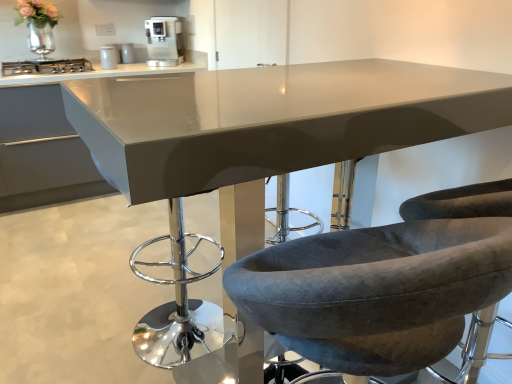
Question: From the image's perspective, is metallic silver coffee machine at upper center, the second appliance viewed from the top, on top of velvet grey chair at center, which is the 1th chair from right to left?

Choices:
 (A) no
 (B) yes

Answer: (B)

Question: Is metallic silver coffee machine at upper center, the second appliance viewed from the top, closer to the viewer compared to velvet grey chair at center, acting as the second chair starting from the left?

Choices:
 (A) yes
 (B) no

Answer: (B)

Question: Is metallic silver coffee machine at upper center, the second appliance positioned from the back, with velvet grey chair at center, which is the 1th chair from right to left?

Choices:
 (A) no
 (B) yes

Answer: (A)

Question: Is metallic silver coffee machine at upper center, which ranks as the 1th appliance in front-to-back order, smaller than velvet grey chair at center, which is the 1th chair from right to left?

Choices:
 (A) no
 (B) yes

Answer: (B)

Question: Is metallic silver coffee machine at upper center, the second appliance viewed from the top, aimed at velvet grey chair at center, which is the 1th chair from right to left?

Choices:
 (A) yes
 (B) no

Answer: (A)

Question: Does metallic silver coffee machine at upper center, marked as the first appliance in a bottom-to-top arrangement, lie behind velvet grey chair at center, acting as the second chair starting from the left?

Choices:
 (A) no
 (B) yes

Answer: (B)

Question: Is velvet grey chair at center, which is the 1th chair from right to left, not inside velvet grey chair at center, arranged as the 1th chair when viewed from the left?

Choices:
 (A) yes
 (B) no

Answer: (A)

Question: Is velvet grey chair at center, the second chair positioned from the right, inside velvet grey chair at center, which is the 1th chair from right to left?

Choices:
 (A) yes
 (B) no

Answer: (B)

Question: Is velvet grey chair at center, which is the 1th chair from right to left, beside velvet grey chair at center, the second chair positioned from the right?

Choices:
 (A) no
 (B) yes

Answer: (A)

Question: Is velvet grey chair at center, which is the 1th chair from right to left, to the right of velvet grey chair at center, the second chair positioned from the right, from the viewer's perspective?

Choices:
 (A) no
 (B) yes

Answer: (B)

Question: From a real-world perspective, does velvet grey chair at center, which is the 1th chair from right to left, sit lower than velvet grey chair at center, arranged as the 1th chair when viewed from the left?

Choices:
 (A) yes
 (B) no

Answer: (A)

Question: From a real-world perspective, is velvet grey chair at center, which is the 1th chair from right to left, located higher than velvet grey chair at center, arranged as the 1th chair when viewed from the left?

Choices:
 (A) yes
 (B) no

Answer: (B)

Question: Is velvet grey chair at center, the second chair positioned from the right, touching metallic silver canister at upper center, positioned as the first appliance in top-to-bottom order?

Choices:
 (A) no
 (B) yes

Answer: (A)